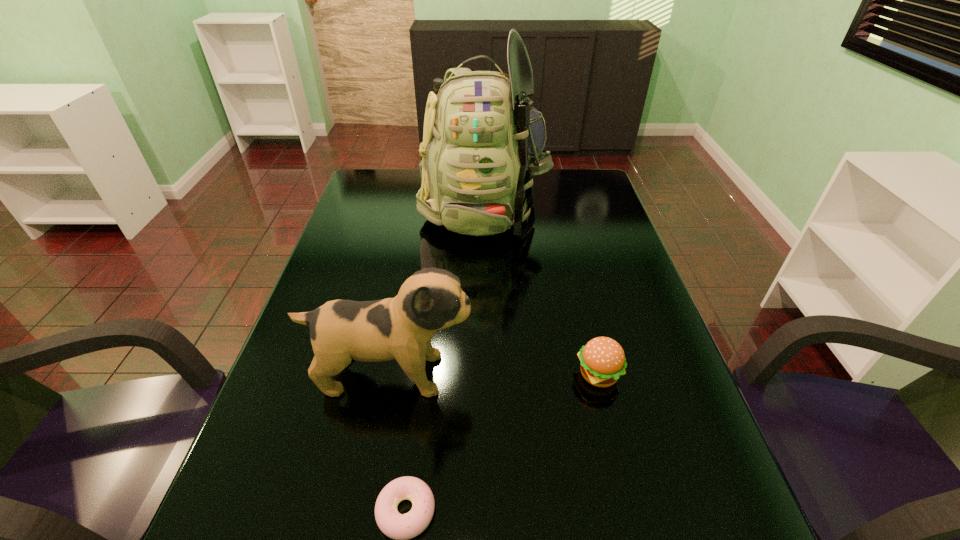
Where is `the closest object to the third shortest object`? the closest object to the third shortest object is located at coordinates (401, 527).

The width and height of the screenshot is (960, 540). I want to click on free space that satisfies the following two spatial constraints: 1. at the face of the third tallest object; 2. on the right side of the third shortest object, so click(392, 375).

Image resolution: width=960 pixels, height=540 pixels. Find the location of `free location that satisfies the following two spatial constraints: 1. on the front-facing side of the farthest object; 2. on the left side of the hamburger`. free location that satisfies the following two spatial constraints: 1. on the front-facing side of the farthest object; 2. on the left side of the hamburger is located at coordinates (484, 375).

Locate an element on the screen. This screenshot has height=540, width=960. free space that satisfies the following two spatial constraints: 1. on the back side of the third tallest object; 2. at the face of the puppy is located at coordinates (598, 374).

Identify the location of vacant region that satisfies the following two spatial constraints: 1. on the back side of the hamburger; 2. at the face of the puppy. (598, 374).